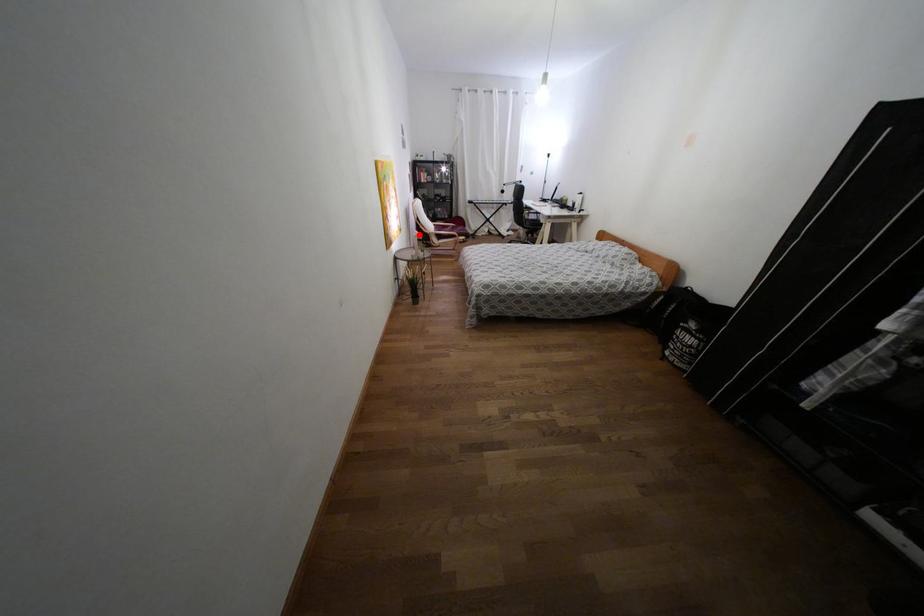
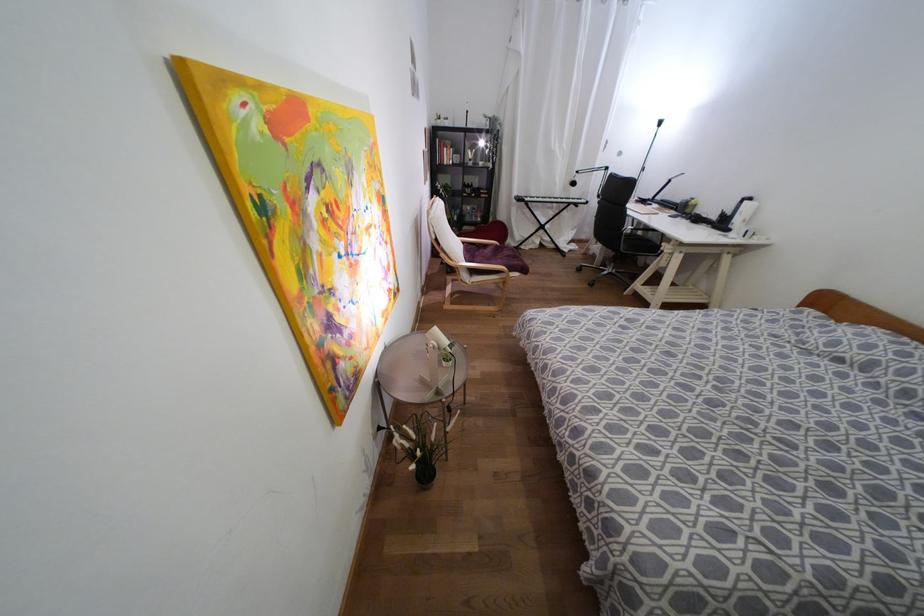
Question: I am providing you with two images of the same scene from different viewpoints. A red point is shown in image1. For the corresponding object point in image2, is it positioned nearer or farther from the camera?

Choices:
 (A) Nearer
 (B) Farther

Answer: (B)